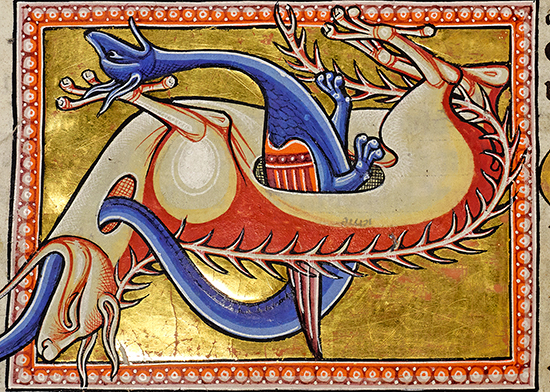
This screenshot has width=550, height=392. In order to click on large rectangular rug in this screenshot , I will do `click(238, 163)`.